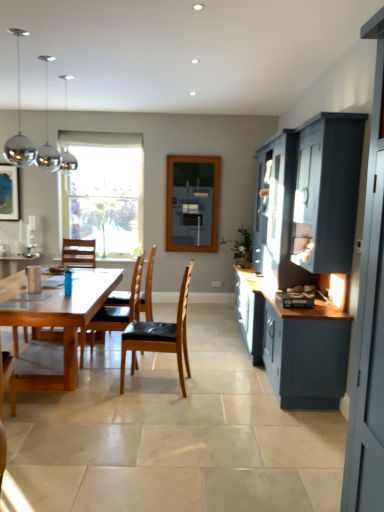
Question: From the image's perspective, is brown leather chair at center, arranged as the first chair when viewed from the back, positioned above or below clear glass window at center?

Choices:
 (A) above
 (B) below

Answer: (B)

Question: Is brown leather chair at center, which is the third chair in front-to-back order, spatially inside clear glass window at center, or outside of it?

Choices:
 (A) inside
 (B) outside

Answer: (B)

Question: Estimate the real-world distances between objects in this image. Which object is closer to the satin silver toaster at lower right?

Choices:
 (A) matte wooden picture frame at left
 (B) light brown wooden chair at center, acting as the 1th chair starting from the front
 (C) brown leather chair at center, which is the third chair in front-to-back order
 (D) light brown wooden table at center
 (E) matte glass window screen at center

Answer: (B)

Question: Based on their relative distances, which object is farther from the matte wooden picture frame at left?

Choices:
 (A) satin silver toaster at lower right
 (B) light brown wooden table at center
 (C) matte glass window screen at center
 (D) light brown wooden chair at center, positioned as the third chair in back-to-front order
 (E) brown leather chair at center, arranged as the first chair when viewed from the back

Answer: (A)